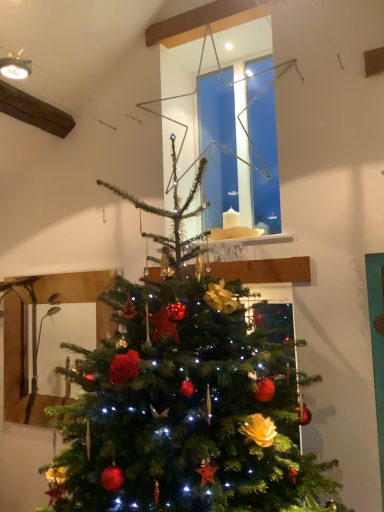
Image resolution: width=384 pixels, height=512 pixels. I want to click on green matte christmas tree at center, so click(185, 400).

Describe the element at coordinates (185, 400) in the screenshot. I see `green matte christmas tree at center` at that location.

Find the location of a particular element. metallic wire star at upper center is located at coordinates (238, 118).

Image resolution: width=384 pixels, height=512 pixels. What do you see at coordinates (238, 118) in the screenshot?
I see `metallic wire star at upper center` at bounding box center [238, 118].

Image resolution: width=384 pixels, height=512 pixels. What are the coordinates of `green matte christmas tree at center` in the screenshot? It's located at (185, 400).

Which object is positioned more to the right, green matte christmas tree at center or metallic wire star at upper center?

metallic wire star at upper center is more to the right.

Does green matte christmas tree at center come in front of metallic wire star at upper center?

Yes, green matte christmas tree at center is in front of metallic wire star at upper center.

Which is in front, point (249, 382) or point (273, 184)?

The point (249, 382) is closer to the camera.

From the image's perspective, which is below, green matte christmas tree at center or metallic wire star at upper center?

green matte christmas tree at center appears lower in the image.

Looking at this image, from a real-world perspective, is green matte christmas tree at center below metallic wire star at upper center?

Yes.

Between green matte christmas tree at center and metallic wire star at upper center, which one has smaller width?

With smaller width is metallic wire star at upper center.

From the picture: Who is taller, green matte christmas tree at center or metallic wire star at upper center?

Standing taller between the two is green matte christmas tree at center.

In terms of size, does green matte christmas tree at center appear bigger or smaller than metallic wire star at upper center?

green matte christmas tree at center is bigger than metallic wire star at upper center.

Looking at this image, is green matte christmas tree at center spatially inside metallic wire star at upper center, or outside of it?

green matte christmas tree at center is not inside metallic wire star at upper center, it's outside.

Would you consider green matte christmas tree at center to be distant from metallic wire star at upper center?

No, green matte christmas tree at center is not far from metallic wire star at upper center.

Is green matte christmas tree at center facing away from metallic wire star at upper center?

green matte christmas tree at center is not turned away from metallic wire star at upper center.

You are a GUI agent. You are given a task and a screenshot of the screen. Output one action in this format:
    pyautogui.click(x=<x>, y=<y>)
    Task: Click on the window located behind the green matte christmas tree at center
    The width and height of the screenshot is (384, 512).
    Given the screenshot: What is the action you would take?
    (x=238, y=118)

Considering the relative positions of metallic wire star at upper center and green matte christmas tree at center in the image provided, is metallic wire star at upper center to the right of green matte christmas tree at center from the viewer's perspective?

Correct, you'll find metallic wire star at upper center to the right of green matte christmas tree at center.

Looking at this image, is the depth of metallic wire star at upper center less than that of green matte christmas tree at center?

That is False.

Which is behind, point (262, 162) or point (82, 490)?

The point (262, 162) is farther.

From the image's perspective, does metallic wire star at upper center appear higher than green matte christmas tree at center?

Correct, metallic wire star at upper center appears higher than green matte christmas tree at center in the image.

From a real-world perspective, is metallic wire star at upper center located higher than green matte christmas tree at center?

Indeed, from a real-world perspective, metallic wire star at upper center stands above green matte christmas tree at center.

Is metallic wire star at upper center wider or thinner than green matte christmas tree at center?

Clearly, metallic wire star at upper center has less width compared to green matte christmas tree at center.

Consider the image. Considering the relative sizes of metallic wire star at upper center and green matte christmas tree at center in the image provided, is metallic wire star at upper center taller than green matte christmas tree at center?

No.

Does metallic wire star at upper center have a smaller size compared to green matte christmas tree at center?

Yes, metallic wire star at upper center is smaller than green matte christmas tree at center.

Is green matte christmas tree at center a part of metallic wire star at upper center?

No.

Is metallic wire star at upper center not near green matte christmas tree at center?

They are positioned close to each other.

From the picture: Could you tell me if metallic wire star at upper center is facing green matte christmas tree at center?

No, metallic wire star at upper center is not aimed at green matte christmas tree at center.

What's the angular difference between metallic wire star at upper center and green matte christmas tree at center's facing directions?

1.69 degrees separate the facing orientations of metallic wire star at upper center and green matte christmas tree at center.

Find the location of `window that appears behind the green matte christmas tree at center`. window that appears behind the green matte christmas tree at center is located at coordinates (238, 118).

Where is `christmas tree in front of the metallic wire star at upper center`? The width and height of the screenshot is (384, 512). christmas tree in front of the metallic wire star at upper center is located at coordinates (185, 400).

In order to click on window positioned vertically above the green matte christmas tree at center (from a real-world perspective) in this screenshot , I will do `click(238, 118)`.